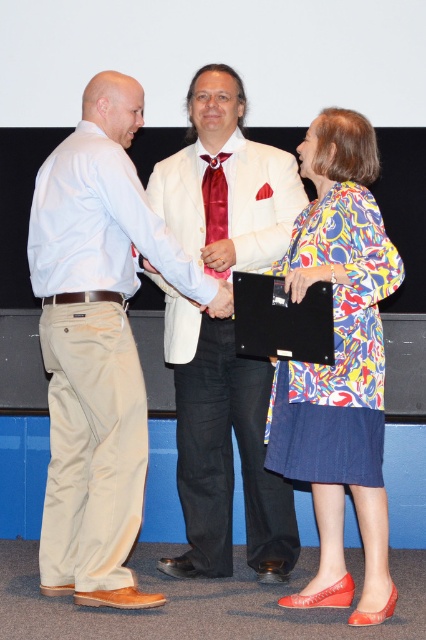
Is white satin suit at center above printed silk blouse at center?

Actually, white satin suit at center is below printed silk blouse at center.

Which is below, white satin suit at center or printed silk blouse at center?

Positioned lower is white satin suit at center.

The width and height of the screenshot is (426, 640). Describe the element at coordinates (222, 451) in the screenshot. I see `white satin suit at center` at that location.

Where is `white satin suit at center`? The width and height of the screenshot is (426, 640). white satin suit at center is located at coordinates (222, 451).

Who is higher up, printed silk blouse at center or satin red tie at center?

Positioned higher is satin red tie at center.

Between point (333, 426) and point (213, 168), which one is positioned behind?

The point (213, 168) is more distant.

You are a GUI agent. You are given a task and a screenshot of the screen. Output one action in this format:
    pyautogui.click(x=<x>, y=<y>)
    Task: Click on the printed silk blouse at center
    The height and width of the screenshot is (640, 426).
    Given the screenshot: What is the action you would take?
    pyautogui.click(x=339, y=364)

From the picture: Can you confirm if khaki cotton pants at left is bigger than satin red tie at center?

Correct, khaki cotton pants at left is larger in size than satin red tie at center.

Is point (91, 518) positioned before point (209, 236)?

Yes, point (91, 518) is closer to viewer.

You are a GUI agent. You are given a task and a screenshot of the screen. Output one action in this format:
    pyautogui.click(x=<x>, y=<y>)
    Task: Click on the khaki cotton pants at left
    This screenshot has width=426, height=640.
    Given the screenshot: What is the action you would take?
    pyautogui.click(x=97, y=342)